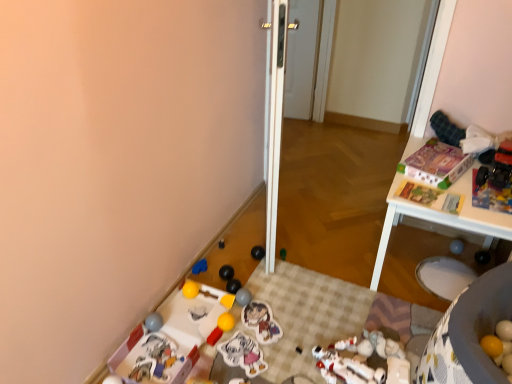
This screenshot has width=512, height=384. Find the location of `free space to the back side of white matte robot at lower center, which is the 5th toy from right to left`. free space to the back side of white matte robot at lower center, which is the 5th toy from right to left is located at coordinates (334, 319).